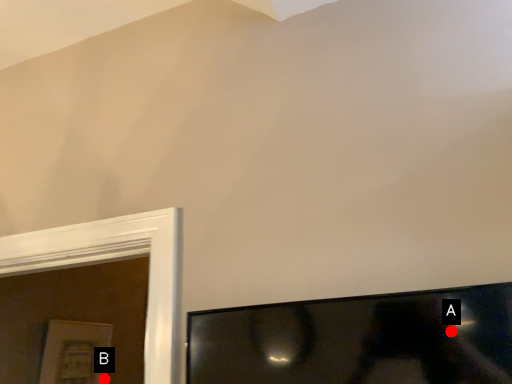
Question: Two points are circled on the image, labeled by A and B beside each circle. Which point appears closest to the camera in this image?

Choices:
 (A) A is closer
 (B) B is closer

Answer: (A)